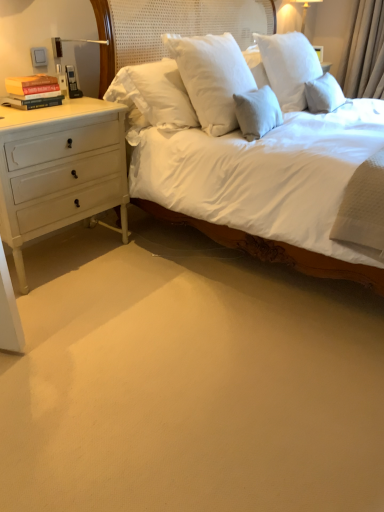
Question: From a real-world perspective, is hardcover books at left physically above white glossy lampshade at upper right?

Choices:
 (A) no
 (B) yes

Answer: (A)

Question: Are hardcover books at left and white glossy lampshade at upper right far apart?

Choices:
 (A) yes
 (B) no

Answer: (A)

Question: From a real-world perspective, is hardcover books at left physically below white glossy lampshade at upper right?

Choices:
 (A) no
 (B) yes

Answer: (B)

Question: Is hardcover books at left facing away from white glossy lampshade at upper right?

Choices:
 (A) no
 (B) yes

Answer: (A)

Question: Is hardcover books at left outside of white glossy lampshade at upper right?

Choices:
 (A) no
 (B) yes

Answer: (B)

Question: From the image's perspective, is hardcover books at left on top of white glossy lampshade at upper right?

Choices:
 (A) yes
 (B) no

Answer: (B)

Question: Considering the relative sizes of hardcover books at left and beige fabric curtain at upper right in the image provided, is hardcover books at left thinner than beige fabric curtain at upper right?

Choices:
 (A) yes
 (B) no

Answer: (A)

Question: From a real-world perspective, is hardcover books at left below beige fabric curtain at upper right?

Choices:
 (A) no
 (B) yes

Answer: (A)

Question: Is hardcover books at left further to the viewer compared to beige fabric curtain at upper right?

Choices:
 (A) yes
 (B) no

Answer: (B)

Question: Can you confirm if hardcover books at left is bigger than beige fabric curtain at upper right?

Choices:
 (A) yes
 (B) no

Answer: (B)

Question: From a real-world perspective, is hardcover books at left positioned over beige fabric curtain at upper right based on gravity?

Choices:
 (A) no
 (B) yes

Answer: (B)

Question: Is hardcover books at left facing towards beige fabric curtain at upper right?

Choices:
 (A) no
 (B) yes

Answer: (A)

Question: Is beige fabric curtain at upper right positioned behind white painted wood chest of drawers at left?

Choices:
 (A) no
 (B) yes

Answer: (B)